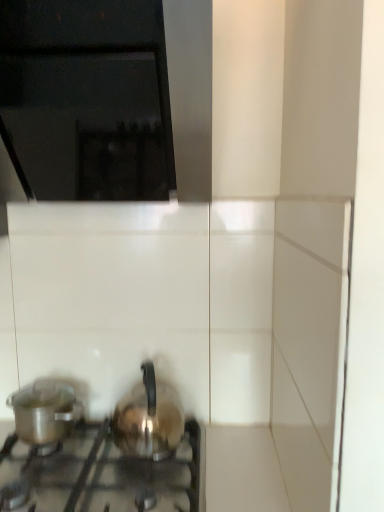
Question: Is black glass vent at upper left surrounded by satin silver kettle at lower left?

Choices:
 (A) no
 (B) yes

Answer: (A)

Question: Does satin silver kettle at lower left have a greater height compared to black glass vent at upper left?

Choices:
 (A) yes
 (B) no

Answer: (B)

Question: Is satin silver kettle at lower left completely or partially outside of black glass vent at upper left?

Choices:
 (A) yes
 (B) no

Answer: (A)

Question: Is satin silver kettle at lower left aimed at black glass vent at upper left?

Choices:
 (A) no
 (B) yes

Answer: (A)

Question: From the image's perspective, is satin silver kettle at lower left over black glass vent at upper left?

Choices:
 (A) yes
 (B) no

Answer: (B)

Question: Would you consider satin silver kettle at lower left to be distant from black glass vent at upper left?

Choices:
 (A) no
 (B) yes

Answer: (A)

Question: From the image's perspective, does metallic silver pot at lower left, the 2th kitchen appliance in the right-to-left sequence, appear lower than shiny metallic kettle at center, the second kitchen appliance viewed from the left?

Choices:
 (A) yes
 (B) no

Answer: (A)

Question: Is metallic silver pot at lower left, the 2th kitchen appliance in the right-to-left sequence, located outside shiny metallic kettle at center, the second kitchen appliance viewed from the left?

Choices:
 (A) yes
 (B) no

Answer: (A)

Question: Can you confirm if metallic silver pot at lower left, which is the first kitchen appliance from left to right, is bigger than shiny metallic kettle at center, the first kitchen appliance in the right-to-left sequence?

Choices:
 (A) no
 (B) yes

Answer: (A)

Question: Considering the relative positions of metallic silver pot at lower left, which is the first kitchen appliance from left to right, and shiny metallic kettle at center, the second kitchen appliance viewed from the left, in the image provided, is metallic silver pot at lower left, which is the first kitchen appliance from left to right, behind shiny metallic kettle at center, the second kitchen appliance viewed from the left,?

Choices:
 (A) yes
 (B) no

Answer: (A)

Question: Is metallic silver pot at lower left, the 2th kitchen appliance in the right-to-left sequence, to the left of shiny metallic kettle at center, the second kitchen appliance viewed from the left, from the viewer's perspective?

Choices:
 (A) no
 (B) yes

Answer: (B)

Question: From the image's perspective, is metallic silver pot at lower left, which is the first kitchen appliance from left to right, on shiny metallic kettle at center, the second kitchen appliance viewed from the left?

Choices:
 (A) no
 (B) yes

Answer: (A)

Question: From the image's perspective, does shiny metallic kettle at center, the second kitchen appliance viewed from the left, appear higher than black glass vent at upper left?

Choices:
 (A) yes
 (B) no

Answer: (B)